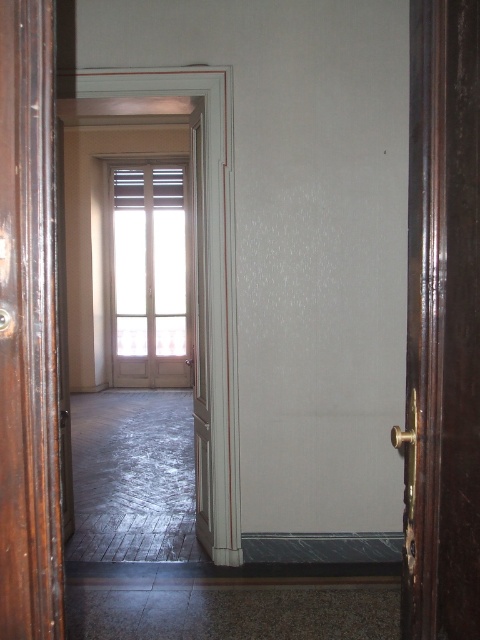
Question: Among these objects, which one is farthest from the camera?

Choices:
 (A) white wooden door at center
 (B) white wood window at center

Answer: (B)

Question: Does dark brown wooden door at left appear under white wood window at center?

Choices:
 (A) no
 (B) yes

Answer: (B)

Question: Does dark brown wooden door at left lie behind white wood window at center?

Choices:
 (A) yes
 (B) no

Answer: (B)

Question: Which point is farther to the camera?

Choices:
 (A) (132, 330)
 (B) (12, 276)
 (C) (203, 118)

Answer: (A)

Question: Observing the image, what is the correct spatial positioning of dark brown wooden door at left in reference to white wooden door at center?

Choices:
 (A) above
 (B) below

Answer: (B)

Question: Which point appears closest to the camera in this image?

Choices:
 (A) (195, 349)
 (B) (21, 259)
 (C) (120, 196)

Answer: (B)